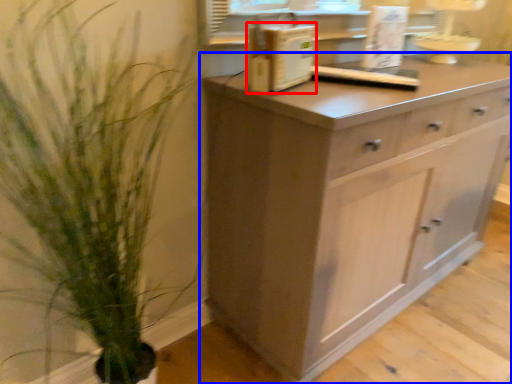
Question: Which of the following is the closest to the observer, appliance (highlighted by a red box) or chest of drawers (highlighted by a blue box)?

Choices:
 (A) appliance
 (B) chest of drawers

Answer: (B)